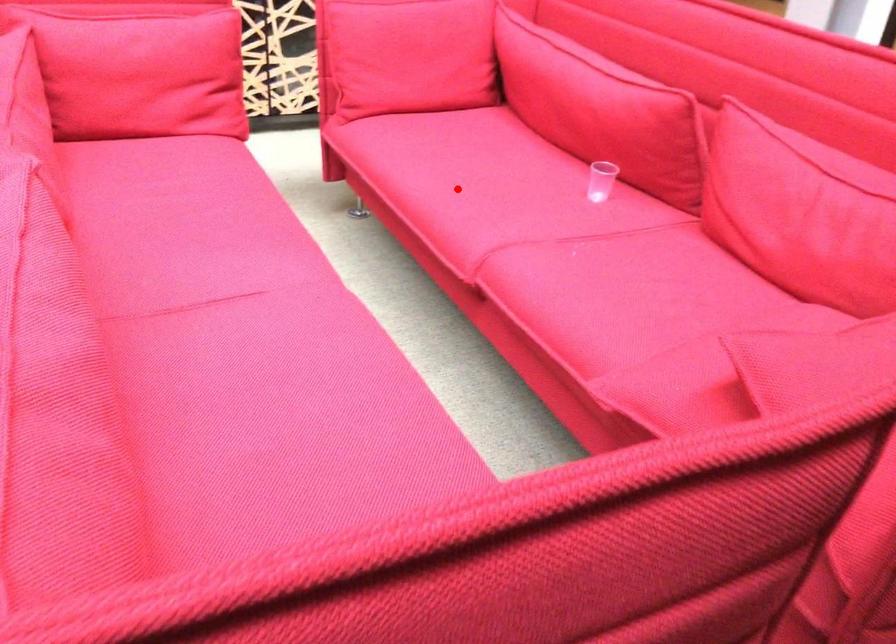
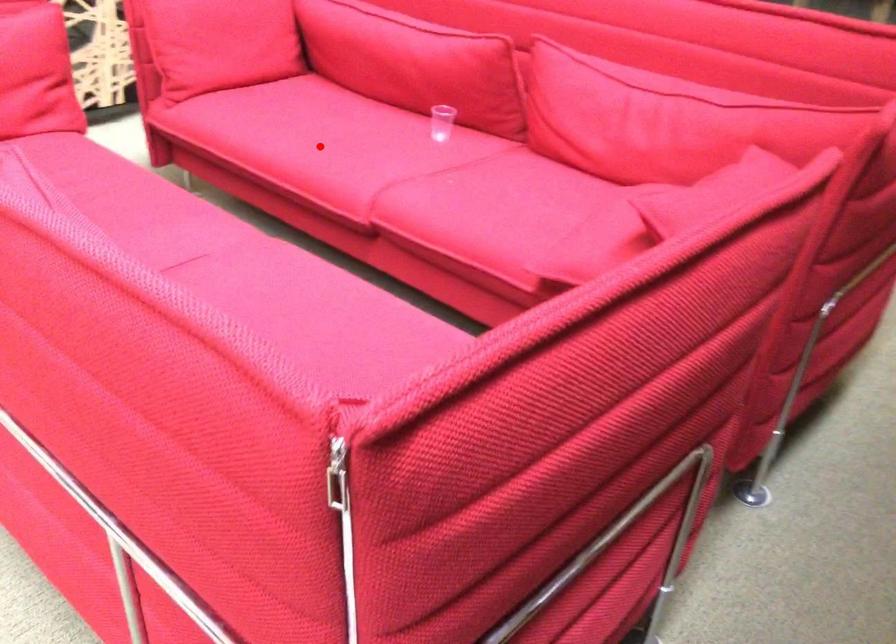
I am providing you with two images of the same scene from different viewpoints. A red point is marked on the first image and another point is marked on the second image. Do the highlighted points in image1 and image2 indicate the same real-world spot?

Yes